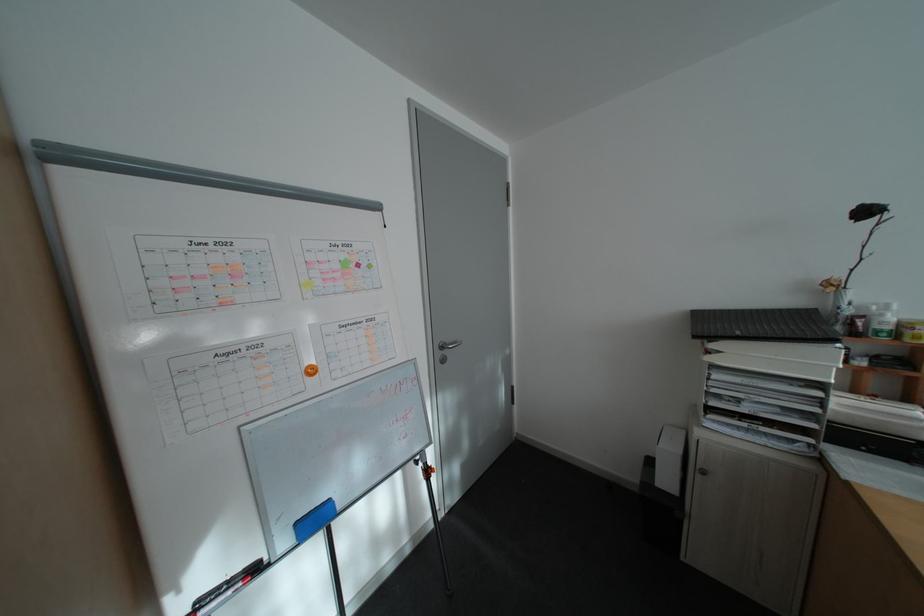
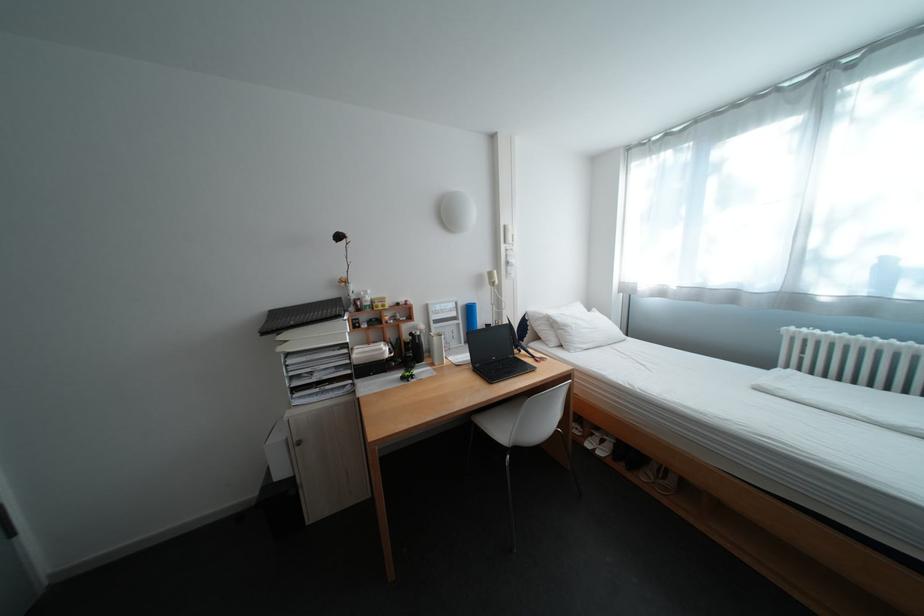
Question: The camera is either moving clockwise (left) or counter-clockwise (right) around the object. The first image is from the beginning of the video and the second image is from the end. Is the camera moving left or right when shooting the video?

Choices:
 (A) Left
 (B) Right

Answer: (A)